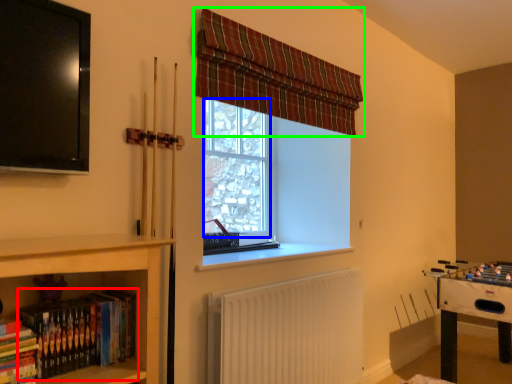
Question: Considering the real-world distances, which object is farthest from book (highlighted by a red box)? bay window (highlighted by a blue box) or curtain (highlighted by a green box)?

Choices:
 (A) bay window
 (B) curtain

Answer: (A)